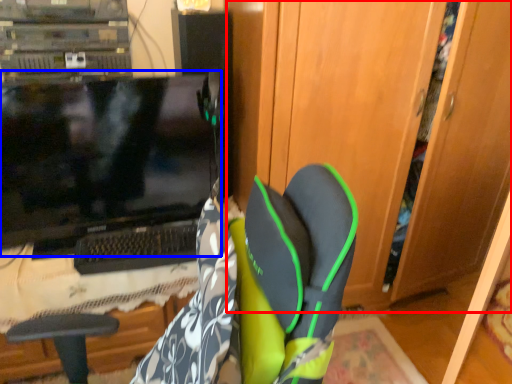
Question: Which of the following is the closest to the observer, dresser (highlighted by a red box) or computer monitor (highlighted by a blue box)?

Choices:
 (A) dresser
 (B) computer monitor

Answer: (A)